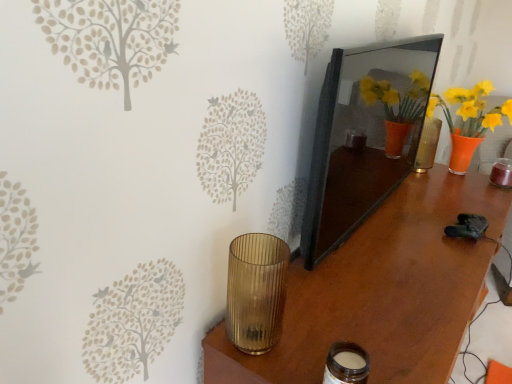
Find the location of a particular element. vacant space that's between matte black mirror at center and gold ribbed glass at lower left, which appears as the 1th candle holder when viewed from the left is located at coordinates (298, 294).